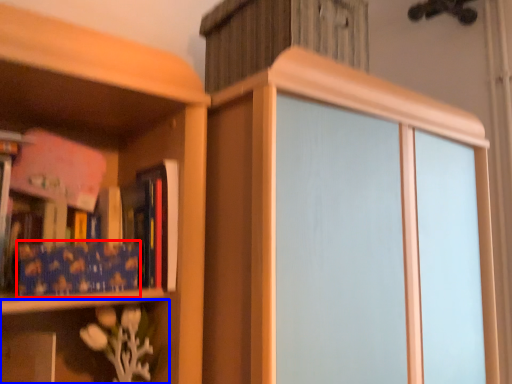
Question: Which of the following is the farthest to the observer, paperback book (highlighted by a red box) or shelf (highlighted by a blue box)?

Choices:
 (A) paperback book
 (B) shelf

Answer: (A)